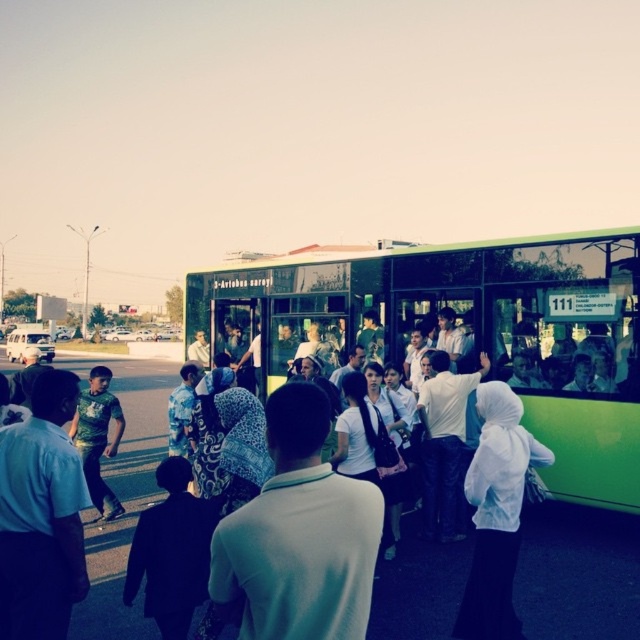
Who is positioned more to the left, green matte bus at center or light blue shirt at left?

Positioned to the left is light blue shirt at left.

Does green matte bus at center have a greater height compared to light blue shirt at left?

Yes.

Is point (570, 356) positioned in front of point (58, 566)?

No, (570, 356) is further to viewer.

Where is `green matte bus at center`? This screenshot has height=640, width=640. green matte bus at center is located at coordinates (467, 330).

Which is behind, point (573, 451) or point (282, 486)?

The point (573, 451) is more distant.

Locate an element on the screen. The width and height of the screenshot is (640, 640). green matte bus at center is located at coordinates (467, 330).

Can you confirm if white fabric headscarf at center is wider than light blue shirt at left?

Yes, white fabric headscarf at center is wider than light blue shirt at left.

What do you see at coordinates (300, 534) in the screenshot? I see `white fabric headscarf at center` at bounding box center [300, 534].

Is point (262, 584) closer to camera compared to point (49, 563)?

Yes, it is.

The width and height of the screenshot is (640, 640). In order to click on white fabric headscarf at center in this screenshot , I will do (300, 534).